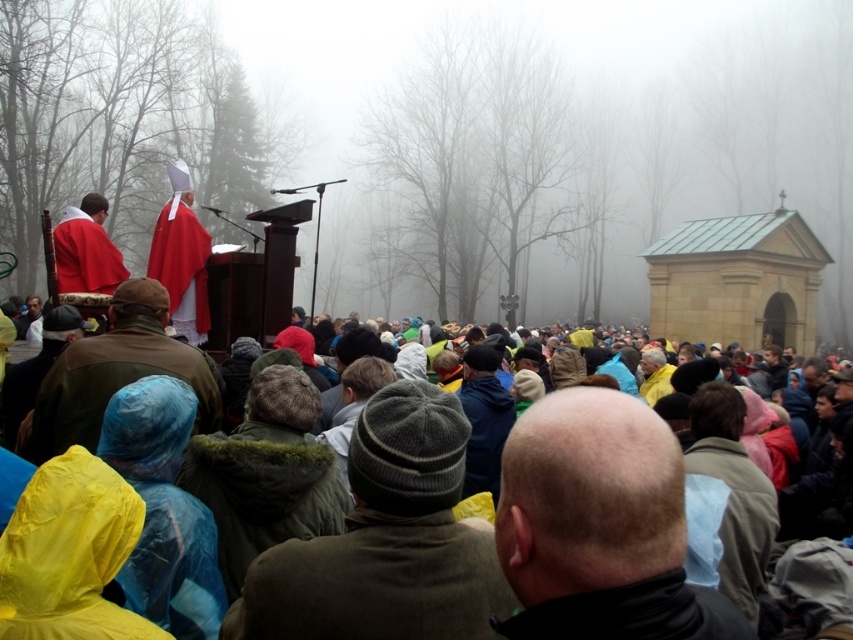
From the picture: You are a photographer trying to capture a clear shot of the brown woolen sweater at center during the outdoor gathering. Given the dense fog and the crowd, can you estimate the visibility of the sweater from your current position?

The brown woolen sweater at center is located at point (375, 582), which means it is positioned near the center of the image. However, due to the dense fog and crowded attendees, it might be partially obscured. Adjust your angle to ensure the sweater is in focus and not blocked by people.

You are organizing a photo shoot and need to position two items in the scene for a winter event. The items are the brown woolen sweater at center and the light blue fabric at center. Based on their heights, which item should you place on a lower shelf to ensure proper visibility of both items?

The brown woolen sweater at center has a lesser height compared to the light blue fabric at center, so you should place the brown woolen sweater at center on the lower shelf to ensure the taller light blue fabric at center can be seen above it.

You are a photographer at the event and want to capture both the light blue fabric at center and the matte red robe at center in a single frame. Which object should you focus on first to ensure both are in the frame?

The light blue fabric at center is not as tall as the matte red robe at center, so you should focus on the matte red robe at center first to ensure both are in the frame.